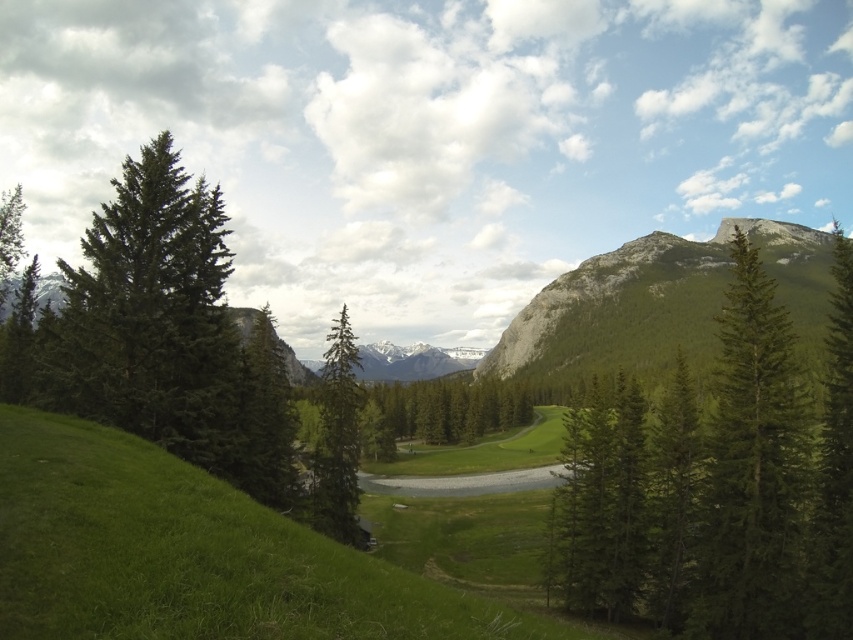
Question: Which of the following is the farthest from the observer?

Choices:
 (A) (704, 316)
 (B) (709, 496)
 (C) (682, 422)
 (D) (335, 381)

Answer: (A)

Question: Among these points, which one is farthest from the camera?

Choices:
 (A) (758, 390)
 (B) (601, 429)
 (C) (782, 237)

Answer: (C)

Question: Which point is closer to the camera taking this photo?

Choices:
 (A) (587, 320)
 (B) (263, 372)

Answer: (B)

Question: Is green matte tree at center in front of green matte tree at center-left?

Choices:
 (A) no
 (B) yes

Answer: (B)

Question: Is green textured tree at center smaller than green matte tree at right?

Choices:
 (A) yes
 (B) no

Answer: (B)

Question: Does green matte tree at center-left have a lesser width compared to white snow-covered mountain at center?

Choices:
 (A) no
 (B) yes

Answer: (B)